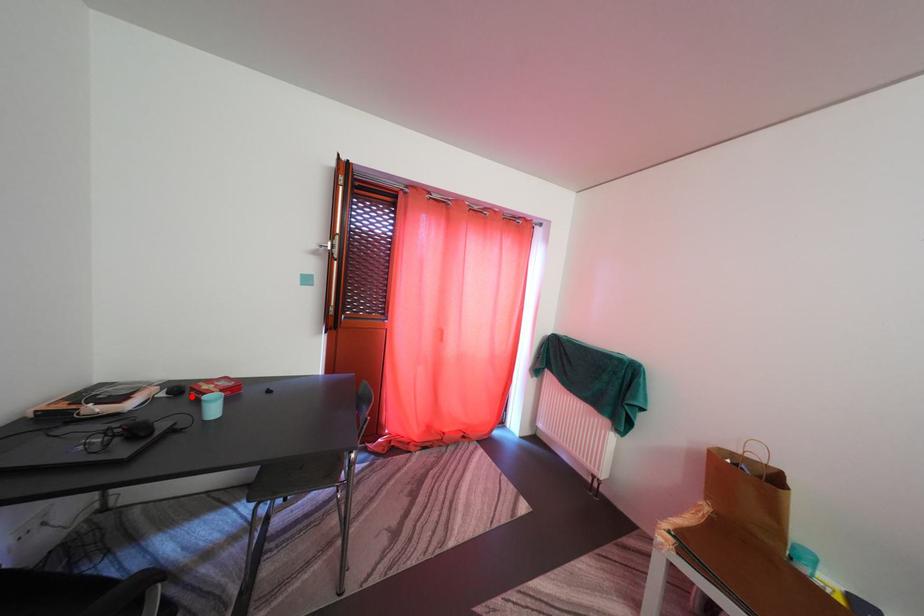
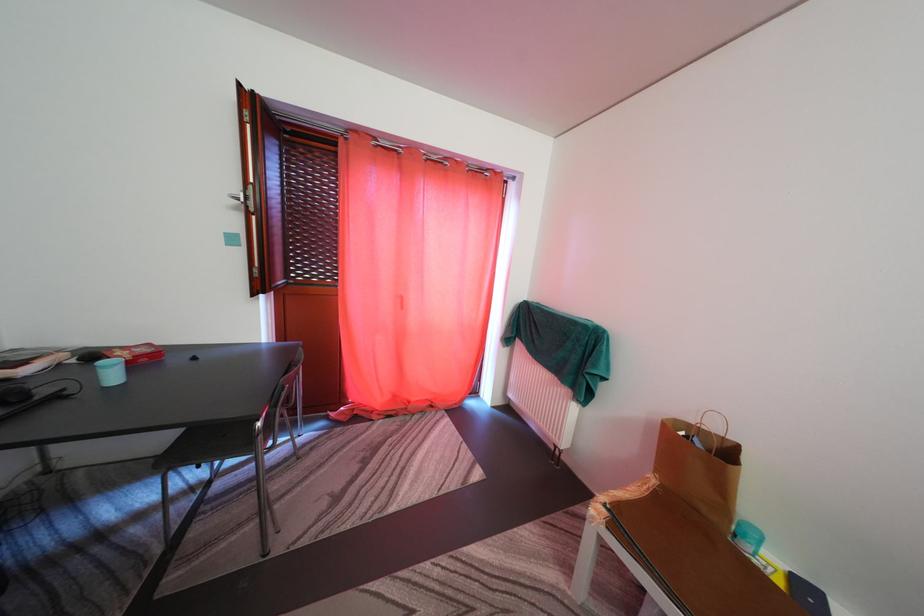
Where in the second image is the point corresponding to the highlighted location from the first image?

(102, 362)